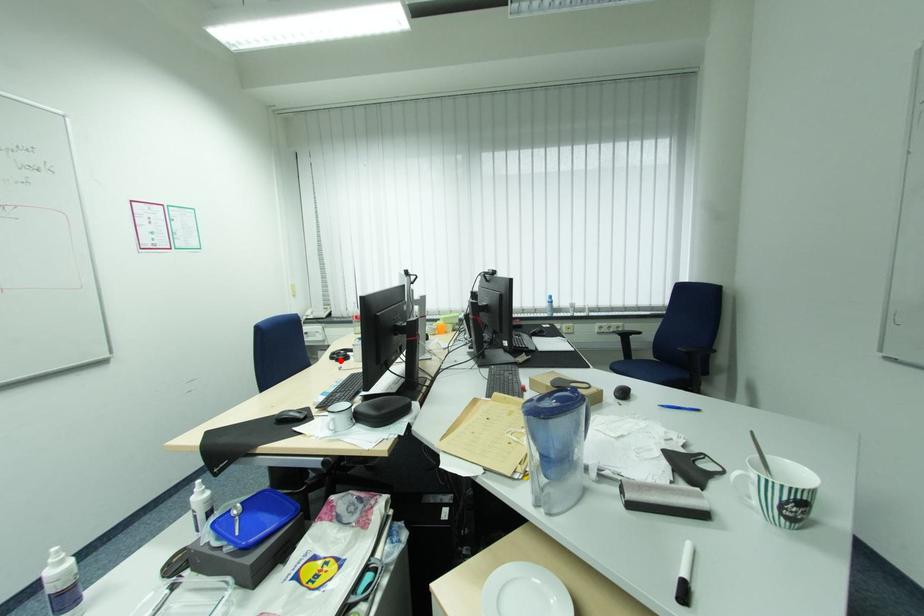
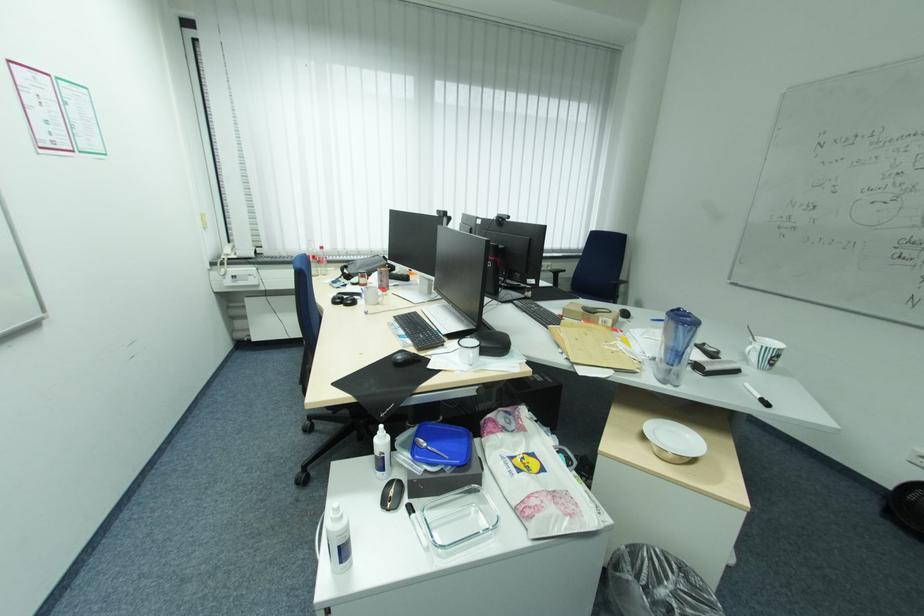
In the second image, find the point that corresponds to the highlighted location in the first image.

(348, 305)